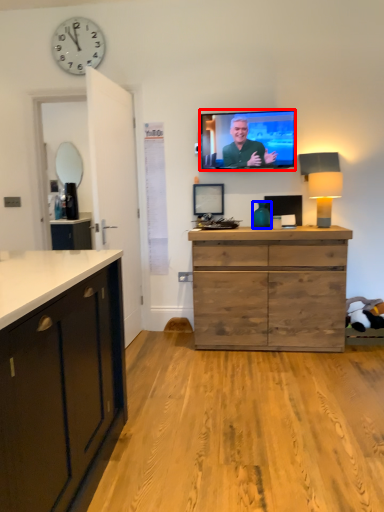
Question: Which object appears farthest to the camera in this image, television (highlighted by a red box) or vase (highlighted by a blue box)?

Choices:
 (A) television
 (B) vase

Answer: (A)